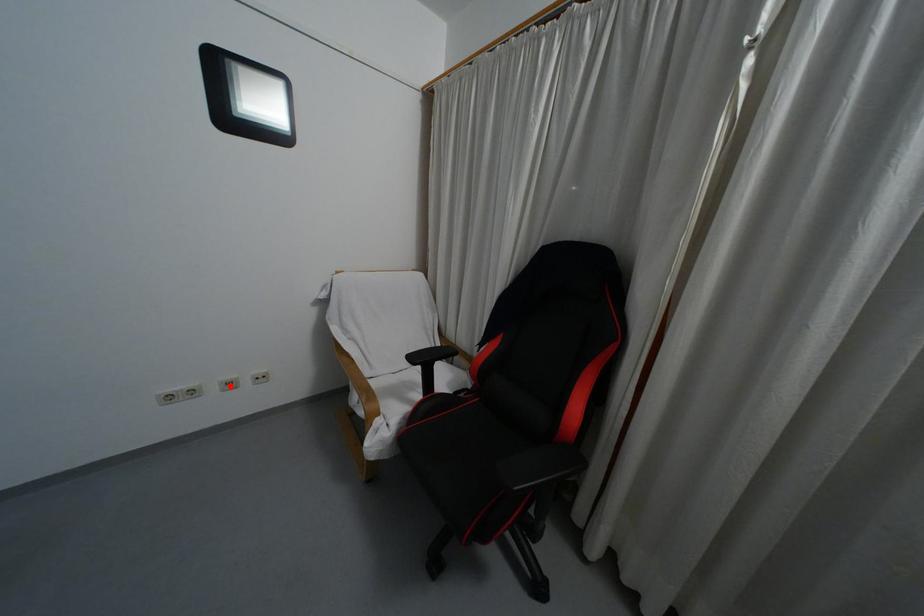
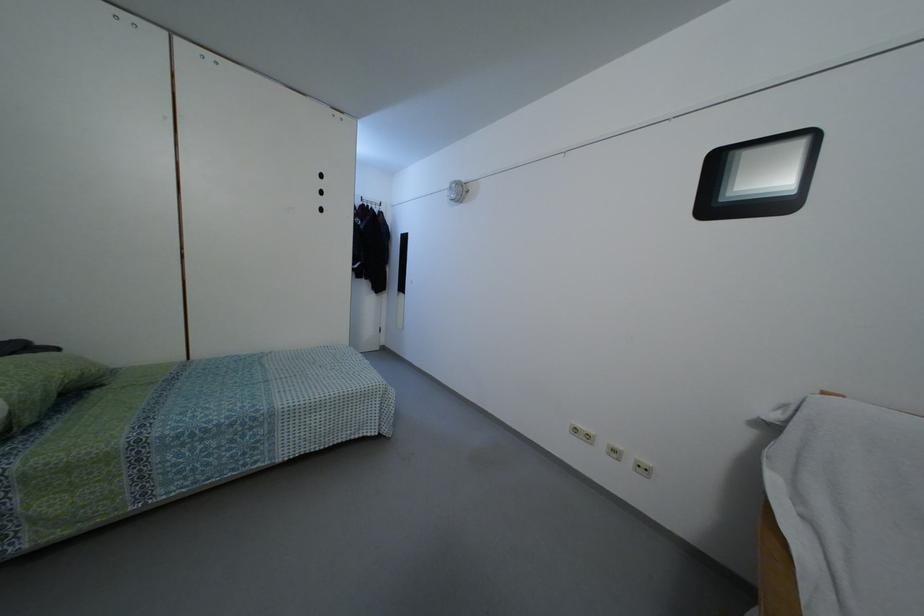
Question: I am providing you with two images of the same scene from different viewpoints. Given a red point in image1, look at the same physical point in image2. Is it:

Choices:
 (A) Closer to the viewpoint
 (B) Farther from the viewpoint

Answer: (B)